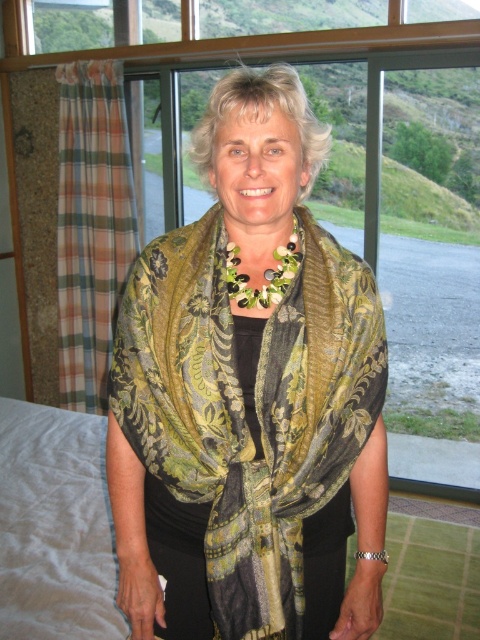
Is green floral silk scarf at center positioned at the back of green floral fabric at center?

That is False.

Does point (197, 500) lie in front of point (256, 301)?

No, it is not.

Locate an element on the screen. This screenshot has width=480, height=640. green floral silk scarf at center is located at coordinates (245, 410).